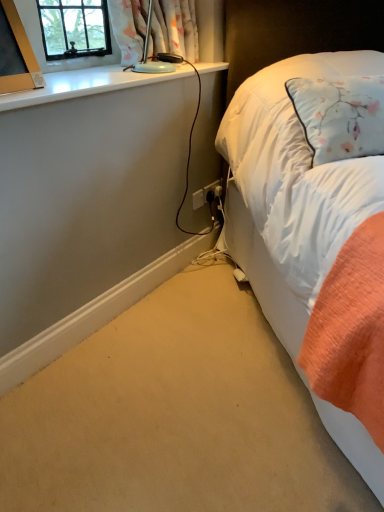
Question: Is the surface of matte gold picture frame at upper left in direct contact with white glossy window sill at upper left?

Choices:
 (A) no
 (B) yes

Answer: (A)

Question: Considering the relative sizes of matte gold picture frame at upper left and white glossy window sill at upper left in the image provided, is matte gold picture frame at upper left wider than white glossy window sill at upper left?

Choices:
 (A) no
 (B) yes

Answer: (A)

Question: From a real-world perspective, does matte gold picture frame at upper left sit lower than white glossy window sill at upper left?

Choices:
 (A) yes
 (B) no

Answer: (B)

Question: From the image's perspective, is matte gold picture frame at upper left over white glossy window sill at upper left?

Choices:
 (A) yes
 (B) no

Answer: (B)

Question: Considering the relative sizes of matte gold picture frame at upper left and white glossy window sill at upper left in the image provided, is matte gold picture frame at upper left bigger than white glossy window sill at upper left?

Choices:
 (A) no
 (B) yes

Answer: (A)

Question: Is white glossy window sill at upper left at the back of matte gold picture frame at upper left?

Choices:
 (A) no
 (B) yes

Answer: (A)

Question: Is the position of white soft bed at right more distant than that of white glossy window sill at upper left?

Choices:
 (A) no
 (B) yes

Answer: (A)

Question: Considering the relative positions of white soft bed at right and white glossy window sill at upper left in the image provided, is white soft bed at right to the right of white glossy window sill at upper left from the viewer's perspective?

Choices:
 (A) yes
 (B) no

Answer: (A)

Question: From the image's perspective, is white soft bed at right located above white glossy window sill at upper left?

Choices:
 (A) yes
 (B) no

Answer: (B)

Question: Is white soft bed at right not close to white glossy window sill at upper left?

Choices:
 (A) yes
 (B) no

Answer: (B)

Question: Does white soft bed at right come in front of white glossy window sill at upper left?

Choices:
 (A) yes
 (B) no

Answer: (A)

Question: Considering the relative positions of white soft bed at right and white glossy window sill at upper left in the image provided, is white soft bed at right to the left of white glossy window sill at upper left from the viewer's perspective?

Choices:
 (A) no
 (B) yes

Answer: (A)

Question: Is the position of matte gold picture frame at upper left less distant than that of floral fabric curtain at upper left?

Choices:
 (A) yes
 (B) no

Answer: (A)